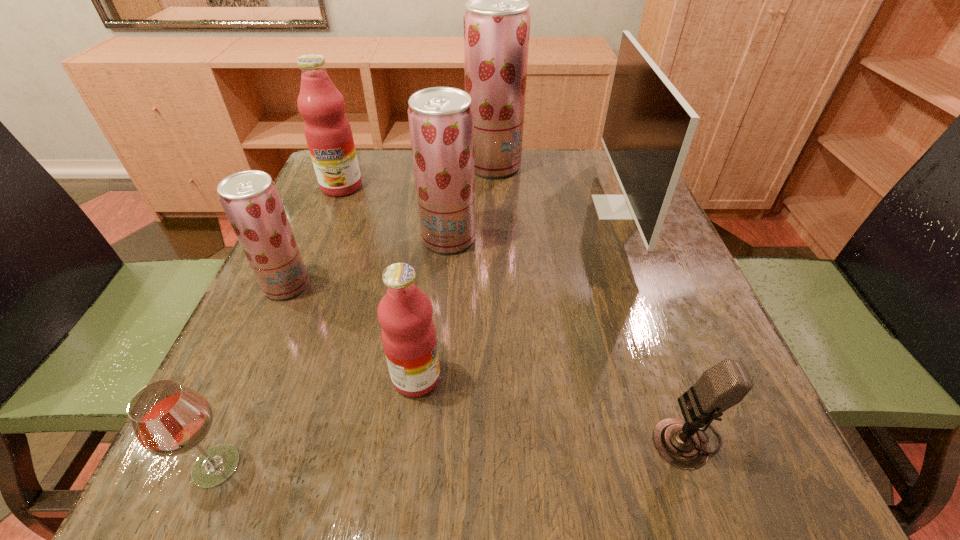
Where is `microphone present at the right edge`? The image size is (960, 540). microphone present at the right edge is located at coordinates (680, 442).

What are the coordinates of `object that is at the far left corner` in the screenshot? It's located at (328, 133).

The image size is (960, 540). In order to click on object situated at the near left corner in this screenshot , I will do `click(169, 419)`.

Find the location of a particular element. The image size is (960, 540). object at the far right corner is located at coordinates [649, 126].

This screenshot has width=960, height=540. What are the coordinates of `object that is at the near right corner` in the screenshot? It's located at [x=680, y=442].

Where is `free point at the far edge`? free point at the far edge is located at coordinates (516, 186).

The width and height of the screenshot is (960, 540). I want to click on vacant space at the near edge of the desktop, so click(x=568, y=459).

The height and width of the screenshot is (540, 960). Find the location of `vacant position at the left edge of the desktop`. vacant position at the left edge of the desktop is located at coordinates (268, 316).

Image resolution: width=960 pixels, height=540 pixels. Identify the location of blank space at the right edge. (622, 274).

In the image, there is a desktop. Where is `vacant area at the far right corner`? The width and height of the screenshot is (960, 540). vacant area at the far right corner is located at coordinates pos(590,190).